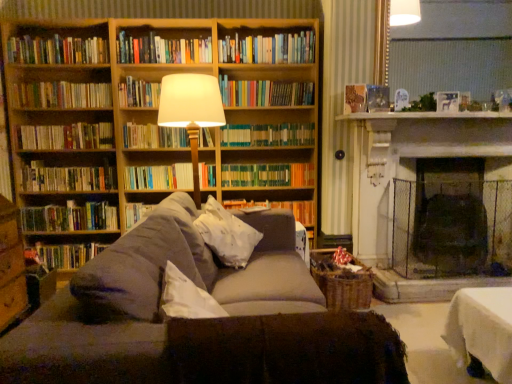
Question: Does hardcover book at center, which is counted as the 9th book, starting from the bottom, have a lesser width compared to wooden bookcase at upper left?

Choices:
 (A) yes
 (B) no

Answer: (A)

Question: Is wooden bookcase at upper left at the back of hardcover book at center, which is counted as the 9th book, starting from the bottom?

Choices:
 (A) no
 (B) yes

Answer: (B)

Question: From the image's perspective, does hardcover book at center, which is counted as the 9th book, starting from the bottom, appear lower than wooden bookcase at upper left?

Choices:
 (A) yes
 (B) no

Answer: (B)

Question: Is hardcover book at center, which is counted as the 9th book, starting from the bottom, at the left side of wooden bookcase at upper left?

Choices:
 (A) yes
 (B) no

Answer: (B)

Question: Does hardcover book at center, the sixth book when ordered from top to bottom, appear on the right side of wooden bookcase at upper left?

Choices:
 (A) yes
 (B) no

Answer: (A)

Question: Does hardcover book at center, which is counted as the 9th book, starting from the bottom, have a lesser height compared to wooden bookcase at upper left?

Choices:
 (A) yes
 (B) no

Answer: (A)

Question: Could you tell me if hardcover book at upper center is facing white soft pillow at center?

Choices:
 (A) no
 (B) yes

Answer: (A)

Question: Is hardcover book at upper center beside white soft pillow at center?

Choices:
 (A) no
 (B) yes

Answer: (A)

Question: Is hardcover book at upper center smaller than white soft pillow at center?

Choices:
 (A) yes
 (B) no

Answer: (A)

Question: From the image's perspective, is hardcover book at upper center above white soft pillow at center?

Choices:
 (A) yes
 (B) no

Answer: (A)

Question: Is hardcover book at upper center surrounding white soft pillow at center?

Choices:
 (A) no
 (B) yes

Answer: (A)

Question: Considering the relative sizes of hardcover book at upper center and white soft pillow at center in the image provided, is hardcover book at upper center shorter than white soft pillow at center?

Choices:
 (A) no
 (B) yes

Answer: (B)

Question: From a real-world perspective, does hardcover book at left, arranged as the 1th book when ordered from the bottom, sit lower than matte white lampshade at center?

Choices:
 (A) yes
 (B) no

Answer: (A)